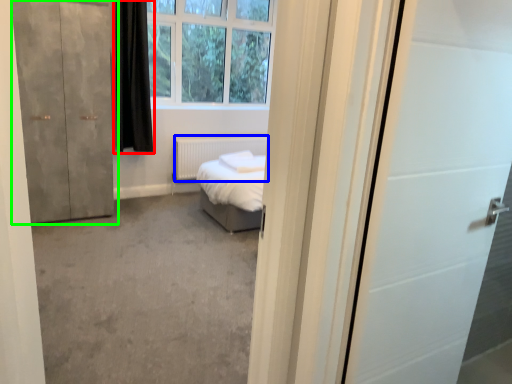
Question: Estimate the real-world distances between objects in this image. Which object is closer to curtain (highlighted by a red box), radiator (highlighted by a blue box) or door (highlighted by a green box)?

Choices:
 (A) radiator
 (B) door

Answer: (B)